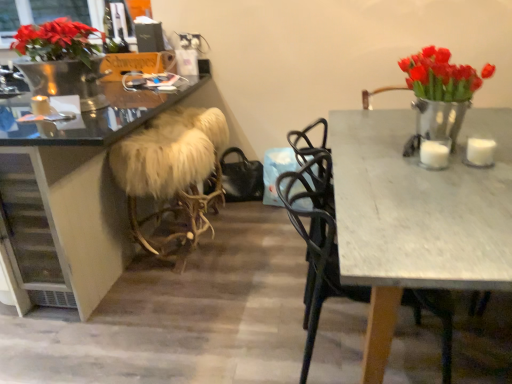
This screenshot has width=512, height=384. I want to click on free spot in front of white matte candle at right, the third candle from the back, so click(460, 180).